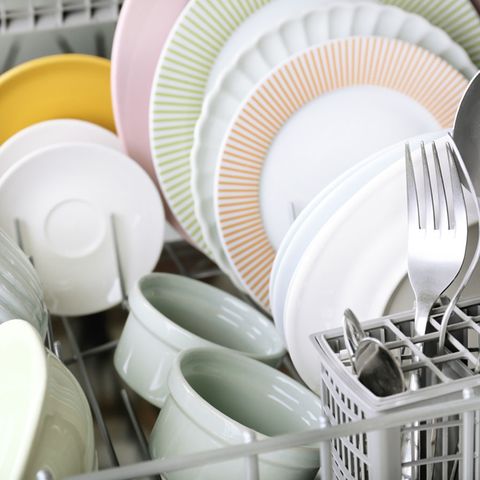
Locate an element on the screen. The image size is (480, 480). openings for silverware is located at coordinates (374, 329), (399, 347), (410, 376), (450, 363), (428, 342), (403, 321), (453, 316), (470, 304), (468, 335).